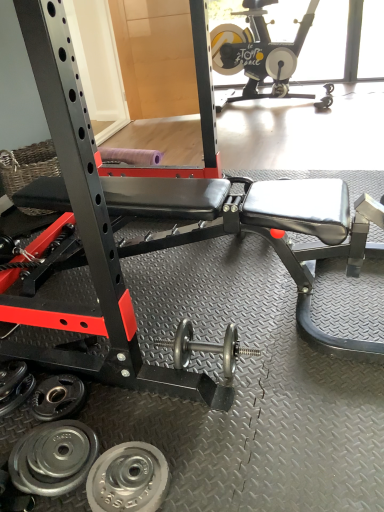
Find the location of a particular element. free space in front of black matte stationary bike at upper right is located at coordinates (323, 135).